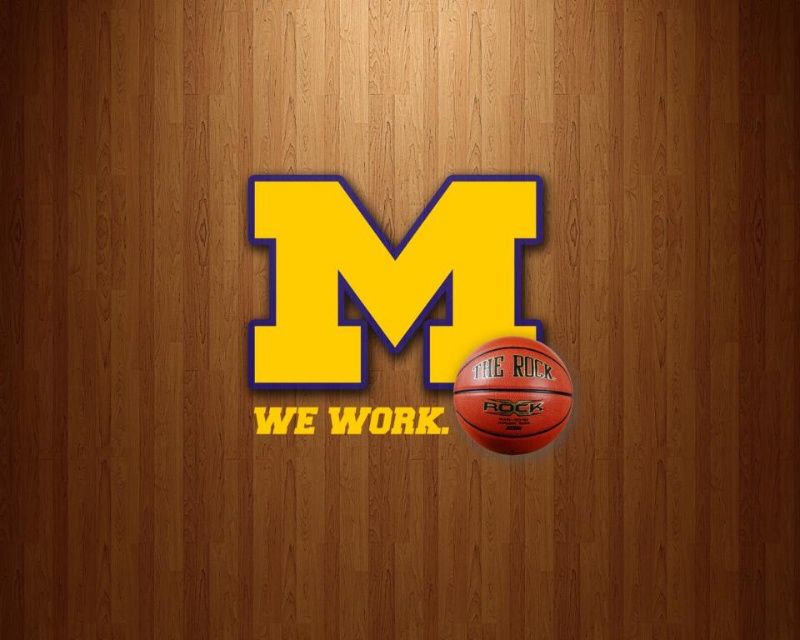
You are designing a poster for a sports event and need to place two basketballs on the poster. The poster has limited space. Given the sizes of the rubber textured basketball at center and the rubber textured basketball at lower right, which basketball should you choose to fit better in a small area?

The rubber textured basketball at lower right is smaller, so it will fit better in a small area.